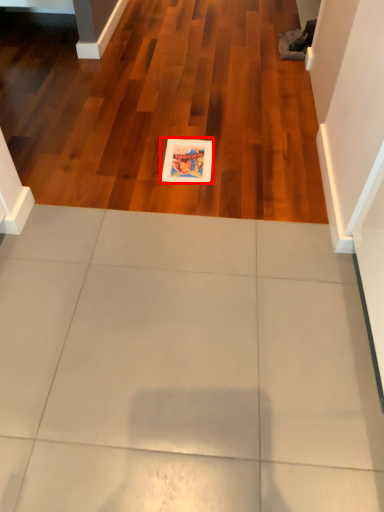
Question: Where is postcard (annotated by the red box) located in relation to ceramic tile in the image?

Choices:
 (A) right
 (B) left

Answer: (A)